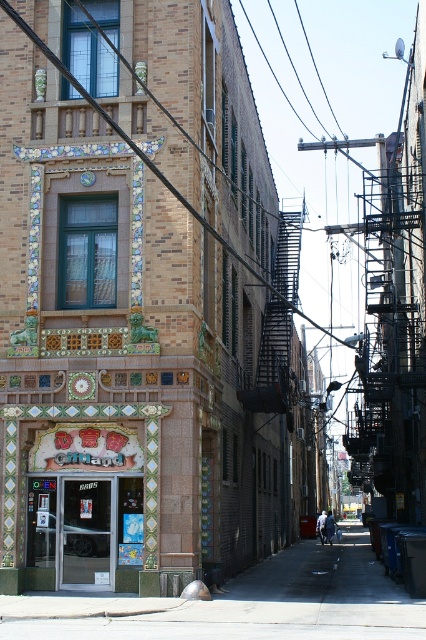
Does concrete sidewalk at lower center have a larger size compared to matte green tile storefront at center?

Indeed, concrete sidewalk at lower center has a larger size compared to matte green tile storefront at center.

Does concrete sidewalk at lower center have a lesser height compared to matte green tile storefront at center?

No.

Is point (353, 538) closer to viewer compared to point (126, 417)?

That is False.

Locate an element on the screen. The width and height of the screenshot is (426, 640). concrete sidewalk at lower center is located at coordinates (247, 604).